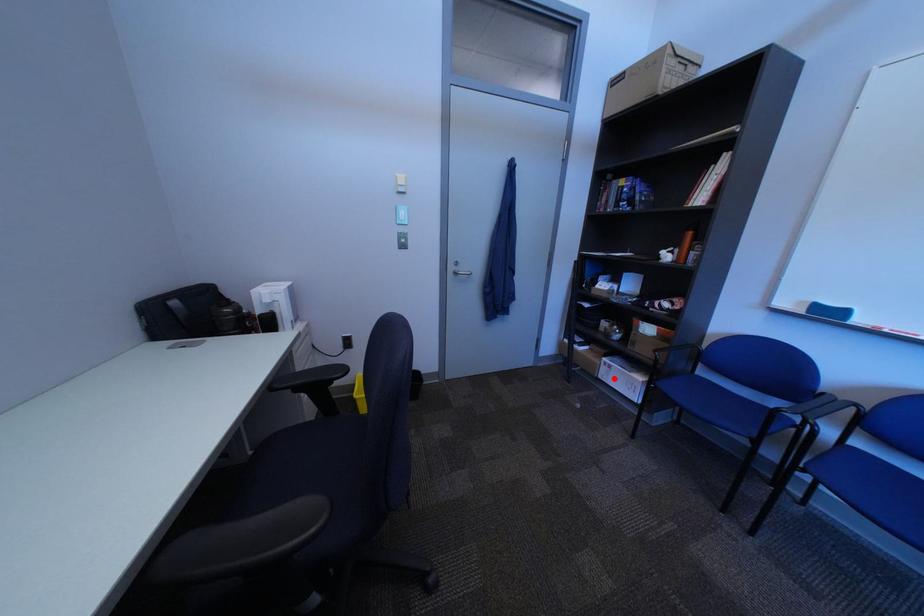
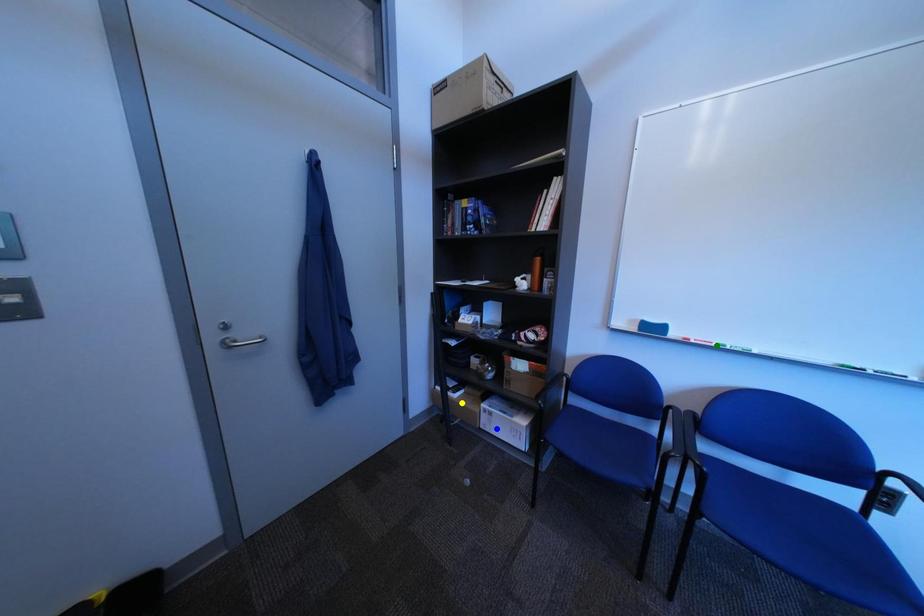
Question: I am providing you with two images of the same scene from different viewpoints. A red point is marked on the first image. You are given multiple points on the second image. Can you choose the point in image 2 that corresponds to the point in image 1?

Choices:
 (A) green point
 (B) blue point
 (C) yellow point

Answer: (B)